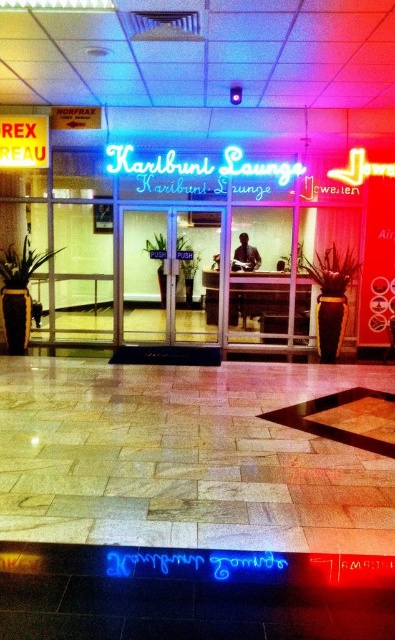
Which is below, transparent glass doors at center or neon sign at center?

transparent glass doors at center

The width and height of the screenshot is (395, 640). What do you see at coordinates (167, 275) in the screenshot? I see `transparent glass doors at center` at bounding box center [167, 275].

Is point (167, 282) farther from viewer compared to point (216, 192)?

Yes, it is.

This screenshot has width=395, height=640. I want to click on transparent glass doors at center, so (167, 275).